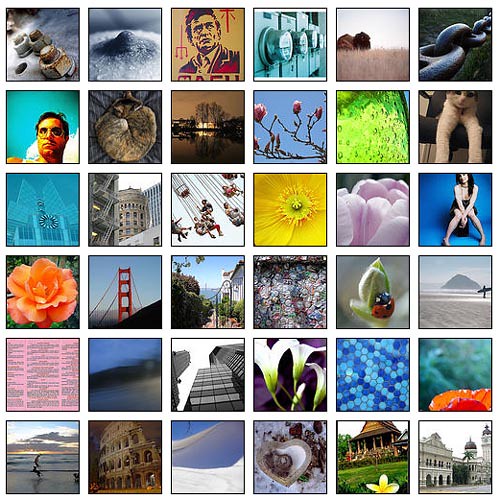
In order to click on flower pictures in this screenshot , I will do `click(294, 375)`, `click(372, 287)`, `click(384, 465)`, `click(54, 285)`, `click(291, 194)`, `click(379, 203)`, `click(361, 124)`, `click(299, 126)`.